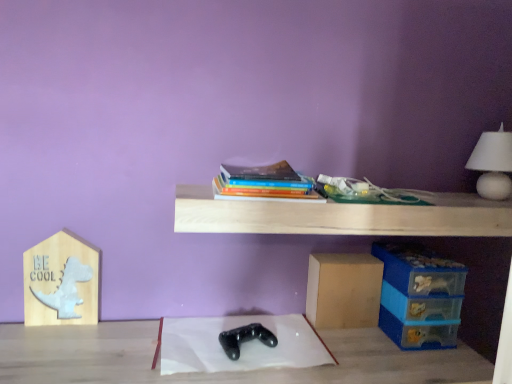
Question: Would you say white paper at center is inside or outside white matte table lamp at upper right?

Choices:
 (A) outside
 (B) inside

Answer: (A)

Question: From their relative heights in the image, would you say white paper at center is taller or shorter than white matte table lamp at upper right?

Choices:
 (A) tall
 (B) short

Answer: (B)

Question: Estimate the real-world distances between objects in this image. Which object is closer to the white matte table lamp at upper right?

Choices:
 (A) light wood shelf at upper center
 (B) blue plastic storage box at lower right
 (C) matte cardboard box at lower center, the 2th cardboard box from the front
 (D) wooden sign at left, positioned as the 2th cardboard box in back-to-front order
 (E) white paper at center

Answer: (A)

Question: Which object is the closest to the light wood shelf at upper center?

Choices:
 (A) white paper at center
 (B) wooden sign at left, arranged as the first cardboard box when viewed from the left
 (C) white matte table lamp at upper right
 (D) blue plastic storage box at lower right
 (E) hardcover books at center

Answer: (E)